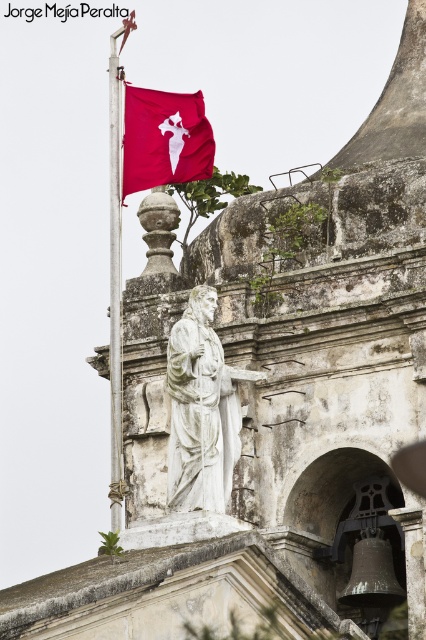
You are standing in front of the aged stone building and want to walk towards the statue. Which point, point (213, 442) or point (127, 157), is closer to the statue?

Point (213, 442) is closer to the statue because it is in front of point (127, 157), meaning it is nearer to the observer.

You are a tourist standing in front of the aged stone building. You want to take a photo of the white marble statue at center and the metallic flag pole at upper left. Which object will appear larger in your photo?

The white marble statue at center will appear larger in your photo because it is closer to you than the metallic flag pole at upper left.